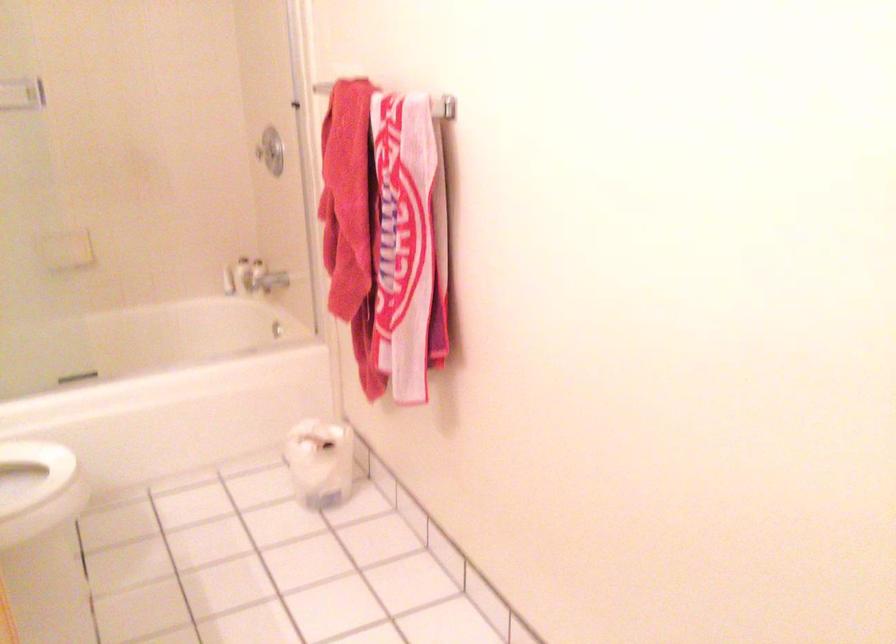
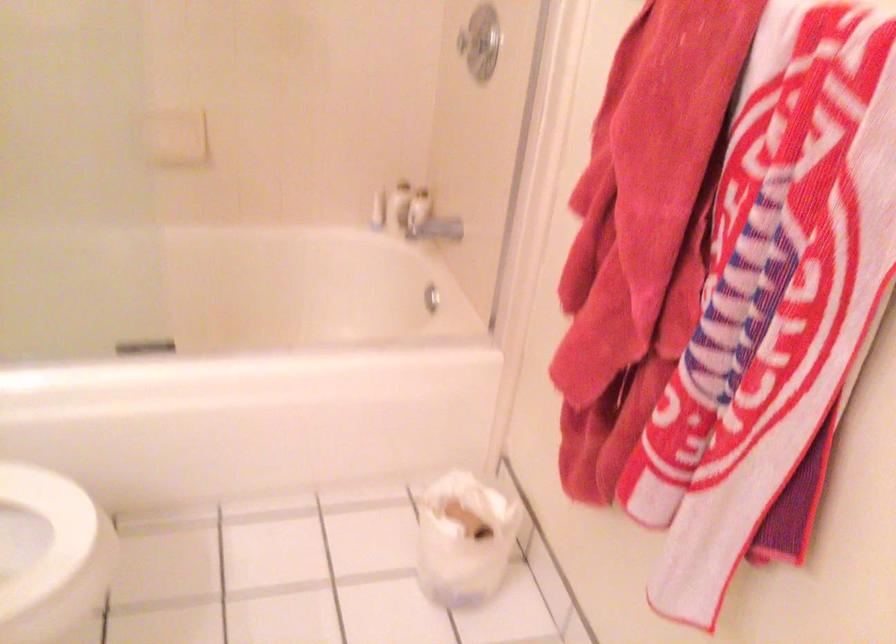
Locate, in the second image, the point that corresponds to (243,275) in the first image.

(399, 205)